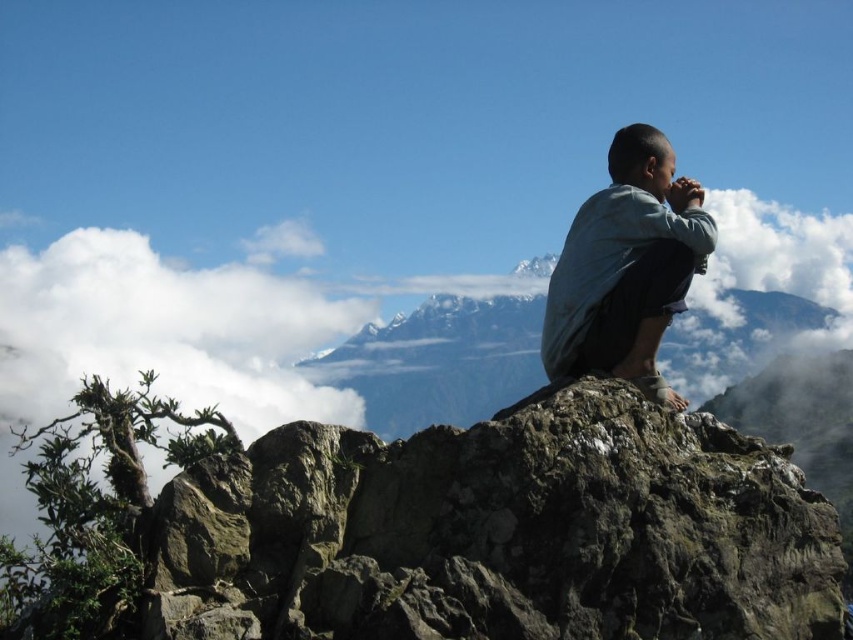
Can you confirm if white fluffy cloud at upper left is positioned to the right of light blue denim shirt at upper right?

In fact, white fluffy cloud at upper left is to the left of light blue denim shirt at upper right.

Is white fluffy cloud at upper left behind light blue denim shirt at upper right?

Yes, it is.

This screenshot has width=853, height=640. What do you see at coordinates (164, 332) in the screenshot?
I see `white fluffy cloud at upper left` at bounding box center [164, 332].

Identify the location of white fluffy cloud at upper left. Image resolution: width=853 pixels, height=640 pixels. (164, 332).

Consider the image. Which is below, rough textured rock at center or white fluffy cloud at upper left?

white fluffy cloud at upper left

Is rough textured rock at center behind white fluffy cloud at upper left?

No, it is not.

Identify the location of rough textured rock at center. This screenshot has width=853, height=640. (500, 531).

Is rough textured rock at center to the left of light blue denim shirt at upper right from the viewer's perspective?

Indeed, rough textured rock at center is positioned on the left side of light blue denim shirt at upper right.

Does point (451, 474) come behind point (616, 362)?

That is False.

Where is `rough textured rock at center`? The width and height of the screenshot is (853, 640). rough textured rock at center is located at coordinates (500, 531).